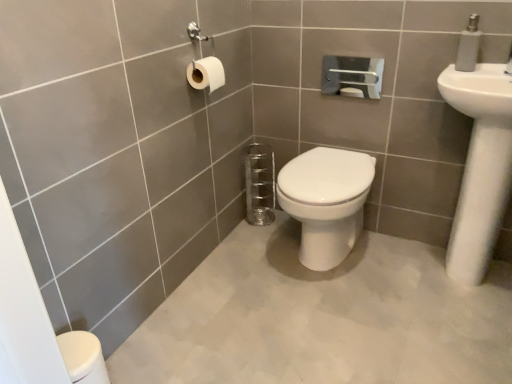
Question: Visually, is white plastic soap dispenser at upper right positioned to the left or to the right of white glossy sink at upper right?

Choices:
 (A) left
 (B) right

Answer: (A)

Question: Is white plastic soap dispenser at upper right bigger or smaller than white glossy sink at upper right?

Choices:
 (A) small
 (B) big

Answer: (A)

Question: Estimate the real-world distances between objects in this image. Which object is farther from the white glossy toilet at center?

Choices:
 (A) white matte toilet paper at upper left
 (B) white plastic soap dispenser at upper right
 (C) white glossy sink at upper right

Answer: (B)

Question: Which is nearer to the white glossy toilet at center?

Choices:
 (A) white glossy sink at upper right
 (B) white plastic soap dispenser at upper right
 (C) white matte toilet paper at upper left

Answer: (A)